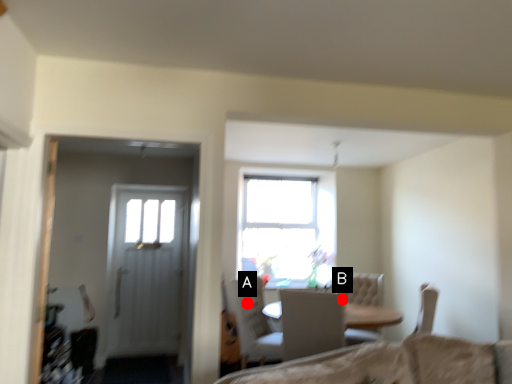
Question: Two points are circled on the image, labeled by A and B beside each circle. Which point is farther to the camera?

Choices:
 (A) A is further
 (B) B is further

Answer: (B)